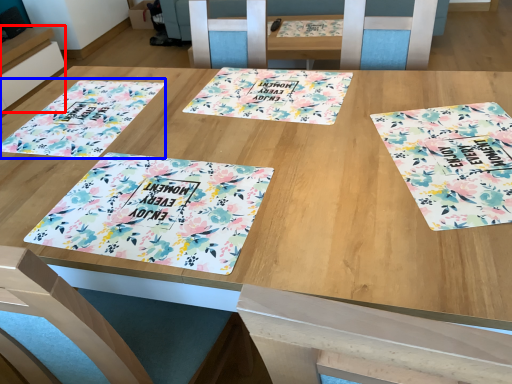
Question: Which object appears farthest to the camera in this image, table (highlighted by a red box) or tablecloth (highlighted by a blue box)?

Choices:
 (A) table
 (B) tablecloth

Answer: (A)